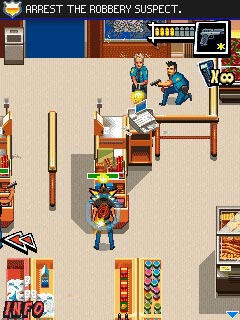
The image size is (240, 320). In order to click on floor in this screenshot , I will do `click(158, 205)`.